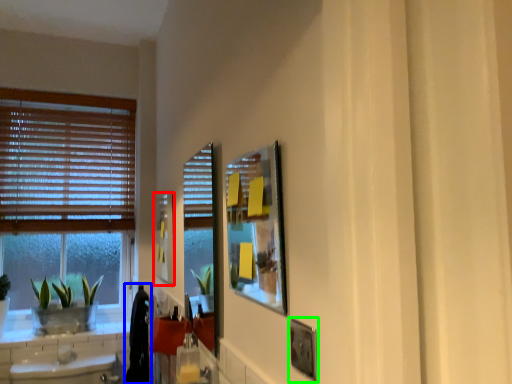
Question: Which is nearer to the picture frame (highlighted by a red box)? laundry (highlighted by a blue box) or picture frame (highlighted by a green box).

Choices:
 (A) laundry
 (B) picture frame

Answer: (A)